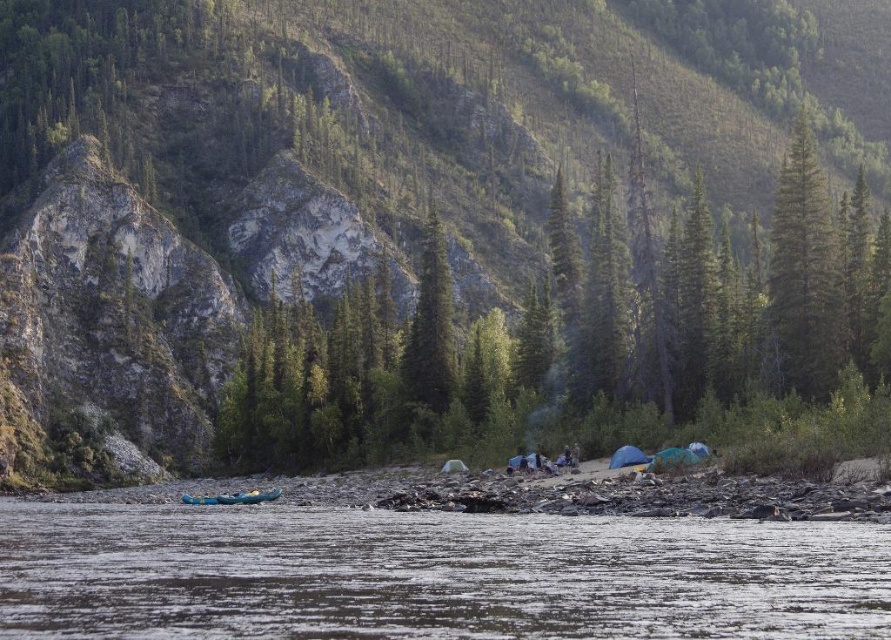
Question: Among these points, which one is farthest from the camera?

Choices:
 (A) (189, 497)
 (B) (816, 556)
 (C) (432, 397)
 (D) (789, 378)

Answer: (C)

Question: Where is clear water at lower center located in relation to teal rubber boat at lower left in the image?

Choices:
 (A) left
 (B) right

Answer: (B)

Question: Based on their relative distances, which object is nearer to the green matte tree at upper right?

Choices:
 (A) green textured tree at center
 (B) teal rubber boat at lower left

Answer: (A)

Question: Does clear water at lower center appear over green matte tree at upper right?

Choices:
 (A) yes
 (B) no

Answer: (B)

Question: Which object is farther from the camera taking this photo?

Choices:
 (A) green matte tree at upper right
 (B) green textured tree at center

Answer: (B)

Question: Is green textured tree at center smaller than teal rubber boat at lower left?

Choices:
 (A) no
 (B) yes

Answer: (A)